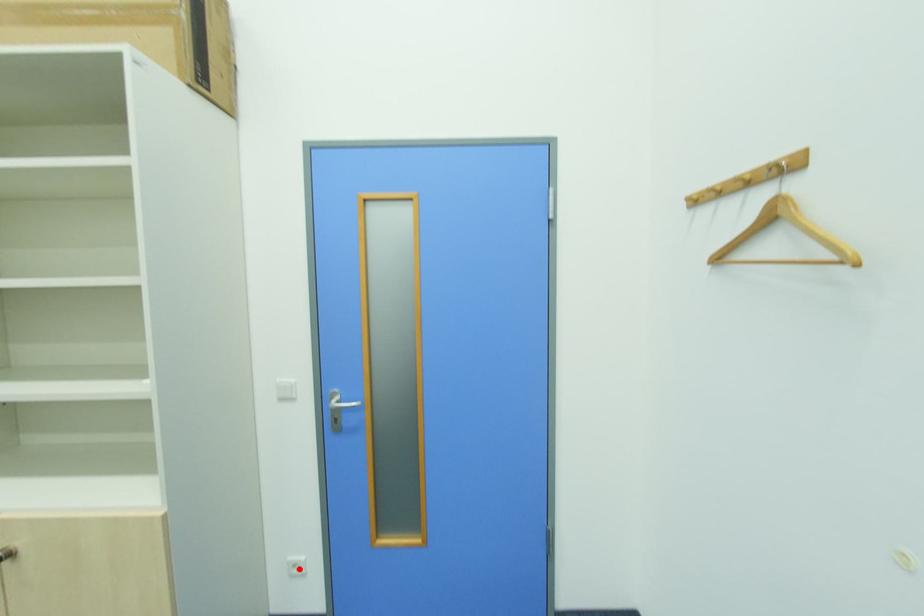
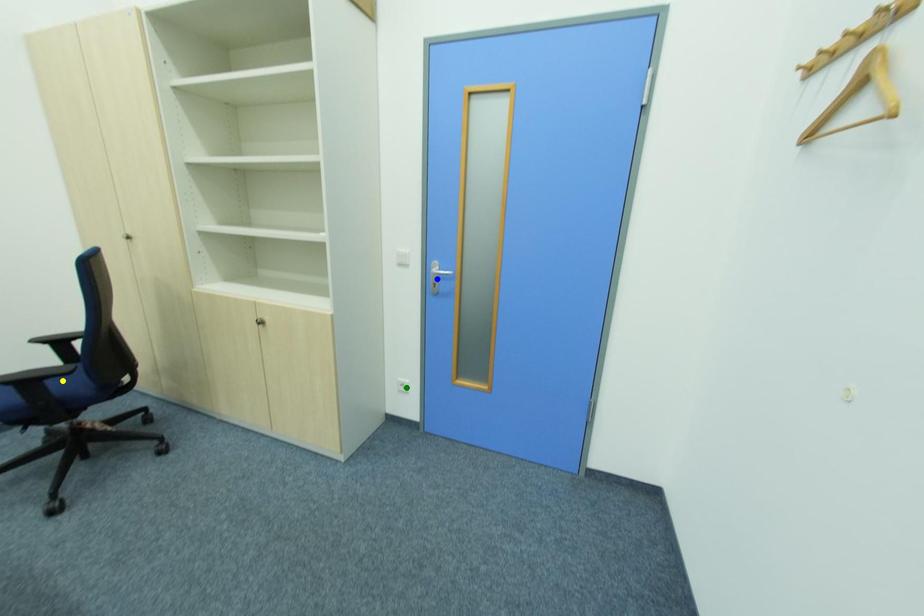
Question: I am providing you with two images of the same scene from different viewpoints. A red point is marked on the first image. You are given multiple points on the second image. Which mark in image 2 goes with the point in image 1?

Choices:
 (A) yellow point
 (B) blue point
 (C) green point

Answer: (C)